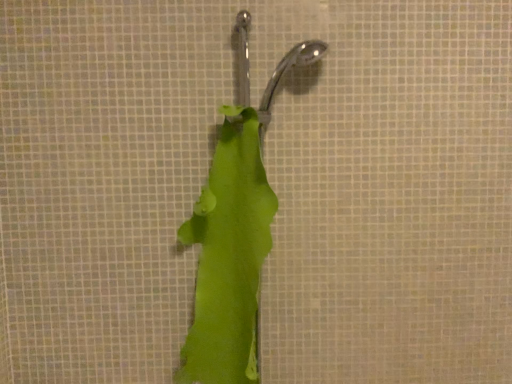
Find the location of `green matte leaf at center`. green matte leaf at center is located at coordinates (228, 258).

Image resolution: width=512 pixels, height=384 pixels. What do you see at coordinates (228, 258) in the screenshot? I see `green matte leaf at center` at bounding box center [228, 258].

This screenshot has height=384, width=512. In order to click on green matte leaf at center in this screenshot , I will do `click(228, 258)`.